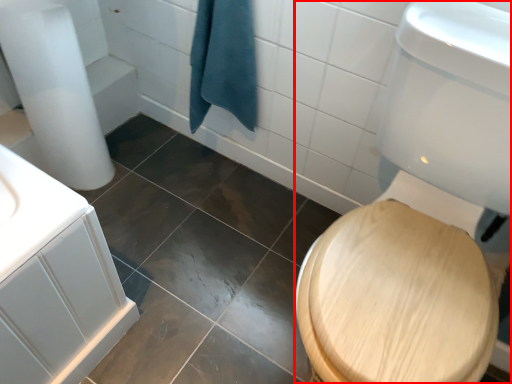
Question: From the image's perspective, considering the relative positions of toilet bowl (annotated by the red box) and bath towel in the image provided, where is toilet bowl (annotated by the red box) located with respect to the staircase?

Choices:
 (A) above
 (B) below

Answer: (B)